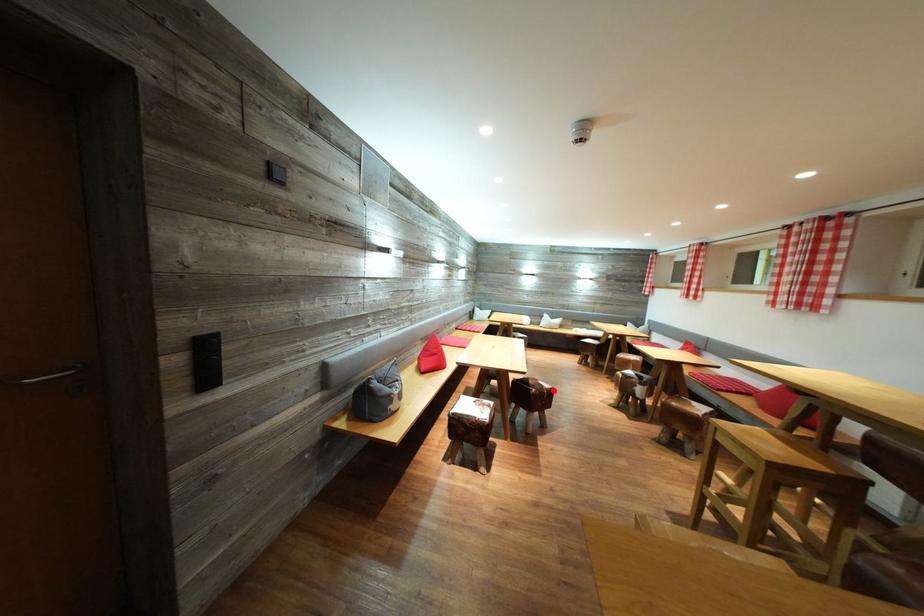
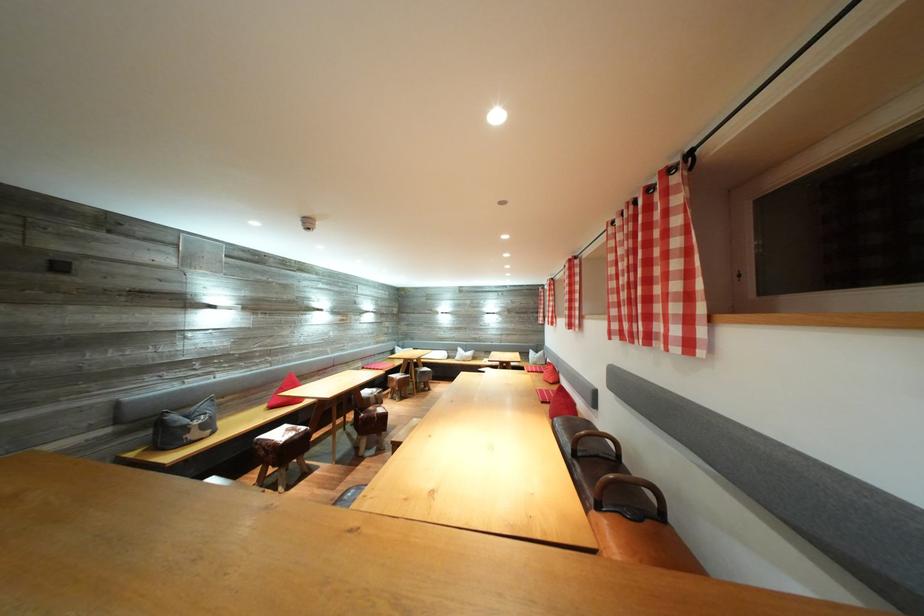
Question: I am providing you with two images of the same scene from different viewpoints. Given a red point in image1, look at the same physical point in image2. Is it:

Choices:
 (A) Closer to the viewpoint
 (B) Farther from the viewpoint

Answer: (A)